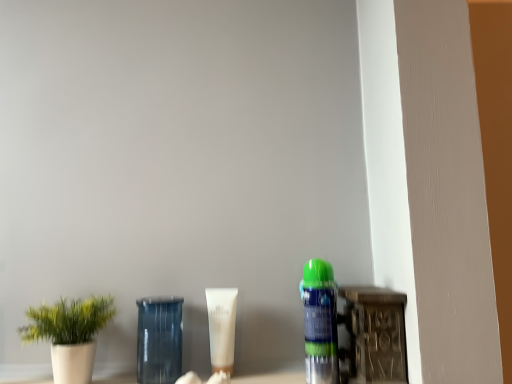
Question: From a real-world perspective, is white matte tube at center under transparent glass jar at center?

Choices:
 (A) no
 (B) yes

Answer: (A)

Question: From a real-world perspective, is white matte tube at center located higher than transparent glass jar at center?

Choices:
 (A) no
 (B) yes

Answer: (B)

Question: Is white matte tube at center behind transparent glass jar at center?

Choices:
 (A) no
 (B) yes

Answer: (B)

Question: Is white matte tube at center turned away from transparent glass jar at center?

Choices:
 (A) yes
 (B) no

Answer: (B)

Question: Is white matte tube at center oriented towards transparent glass jar at center?

Choices:
 (A) yes
 (B) no

Answer: (B)

Question: Considering the positions of transparent glass jar at center and white matte plant pot at left in the image, is transparent glass jar at center taller or shorter than white matte plant pot at left?

Choices:
 (A) short
 (B) tall

Answer: (B)

Question: Is transparent glass jar at center inside or outside of white matte plant pot at left?

Choices:
 (A) inside
 (B) outside

Answer: (B)

Question: Is transparent glass jar at center bigger or smaller than white matte plant pot at left?

Choices:
 (A) big
 (B) small

Answer: (B)

Question: From a real-world perspective, is transparent glass jar at center above or below white matte plant pot at left?

Choices:
 (A) below
 (B) above

Answer: (A)

Question: From their relative heights in the image, would you say transparent glass jar at center is taller or shorter than white matte tube at center?

Choices:
 (A) short
 (B) tall

Answer: (B)

Question: Does point (166, 304) appear closer or farther from the camera than point (225, 331)?

Choices:
 (A) farther
 (B) closer

Answer: (A)

Question: From the image's perspective, relative to white matte tube at center, is transparent glass jar at center above or below?

Choices:
 (A) below
 (B) above

Answer: (A)

Question: Is transparent glass jar at center inside the boundaries of white matte tube at center, or outside?

Choices:
 (A) outside
 (B) inside

Answer: (A)

Question: Is white matte plant pot at left inside or outside of white matte tube at center?

Choices:
 (A) outside
 (B) inside

Answer: (A)

Question: Visually, is white matte plant pot at left positioned to the left or to the right of white matte tube at center?

Choices:
 (A) right
 (B) left

Answer: (B)